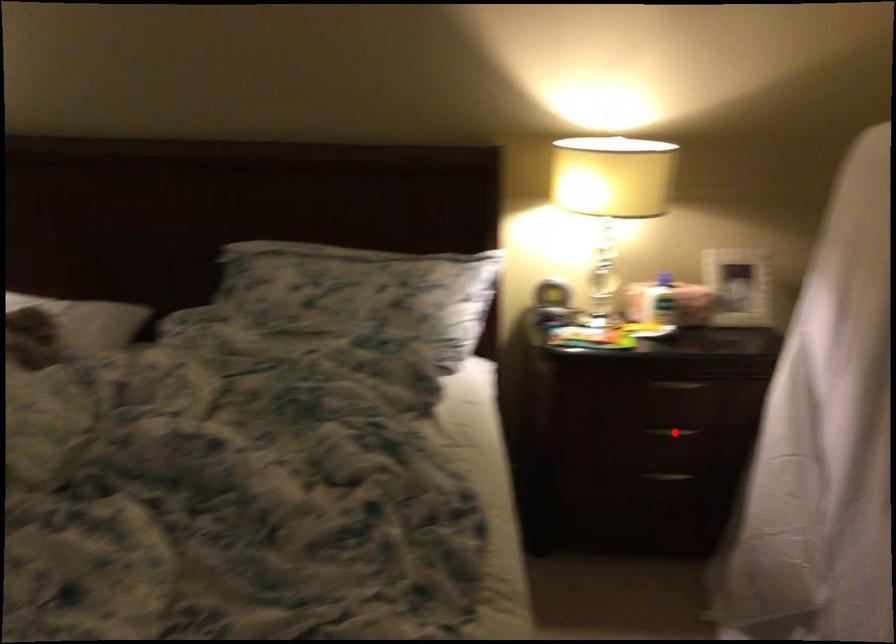
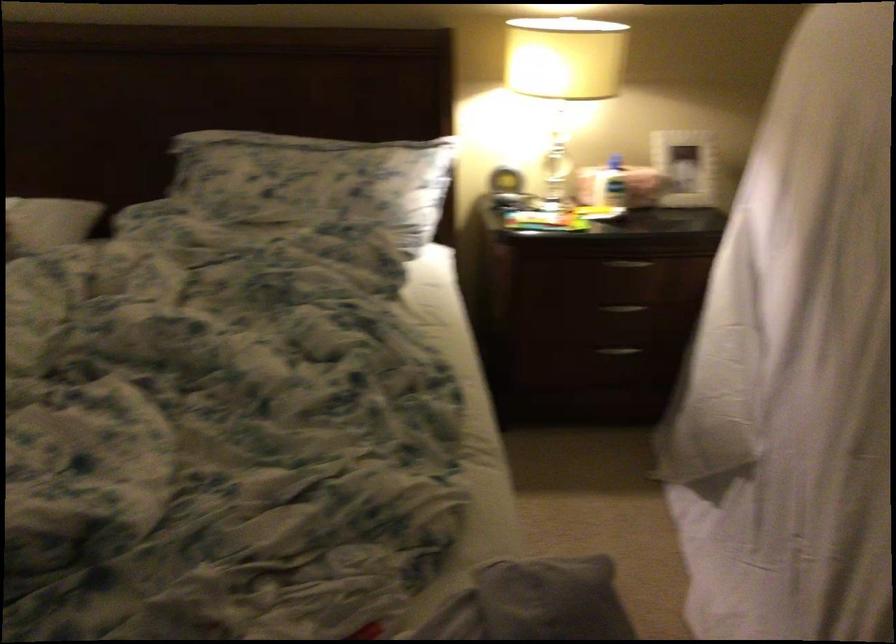
The point at the highlighted location is marked in the first image. Where is the corresponding point in the second image?

(624, 308)